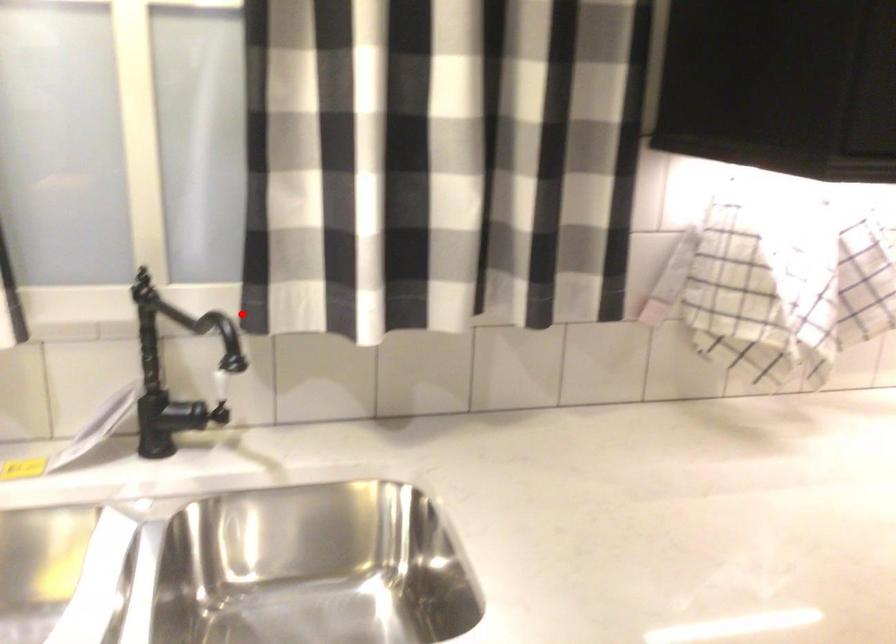
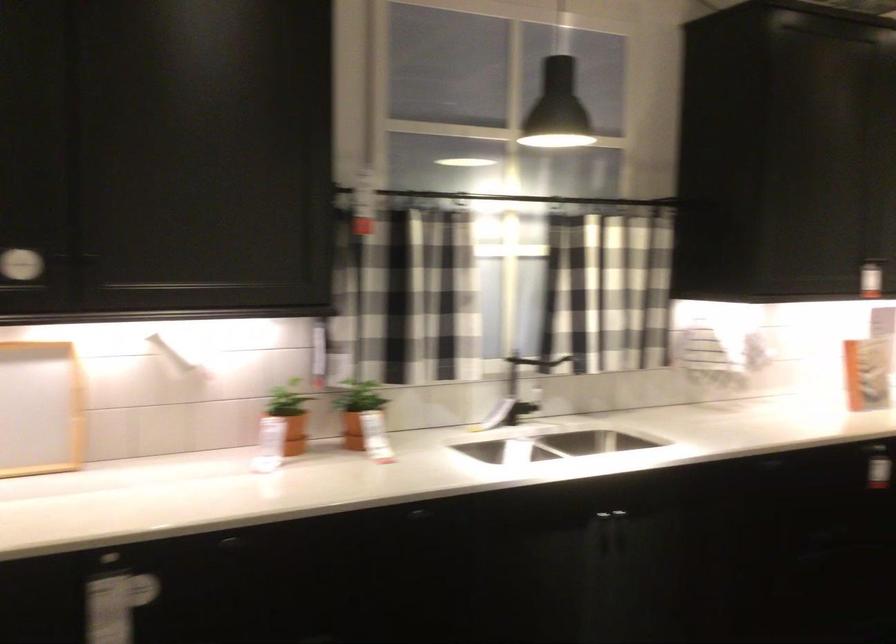
Question: I am providing you with two images of the same scene from different viewpoints. In image1, a red point is highlighted. Considering the same 3D point in image2, which of the following is correct?

Choices:
 (A) It is closer
 (B) It is farther

Answer: (B)